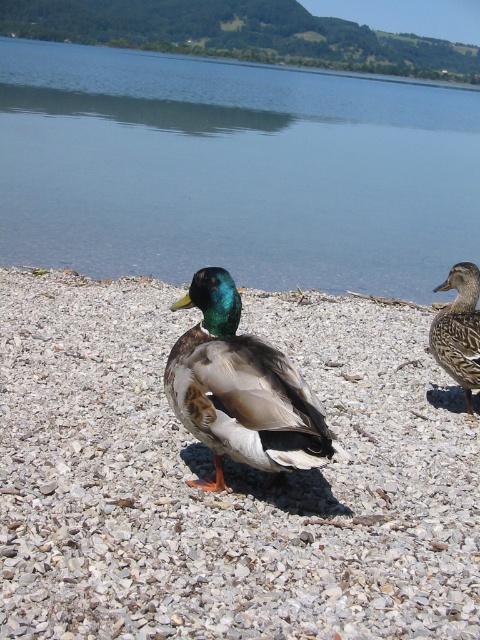
You are standing on the shore and want to place a small toy boat in the scene. The boat requires a flat surface that is taller than the gray gravel at center. Can you place the boat on the transparent water at center?

The transparent water at center is taller than the gray gravel at center, so yes, you can place the boat on the transparent water at center since it meets the requirement of being taller than the gray gravel at center.

You are standing at the edge of the lake and see the shiny green and brown duck at center and the gray gravel at center. Which object is closer to your right side?

The gray gravel at center is to the right of the shiny green and brown duck at center, so the gray gravel at center is closer to your right side.

You are a photographer aiming to capture both the gray gravel at center and the shiny green and brown duck at center in a single frame. Based on their widths, which object should you focus on to ensure both fit in the shot?

The gray gravel at center is wider than the shiny green and brown duck at center. To ensure both fit in the shot, focus on the gray gravel at center as it occupies more space, allowing the duck to be included within the frame.